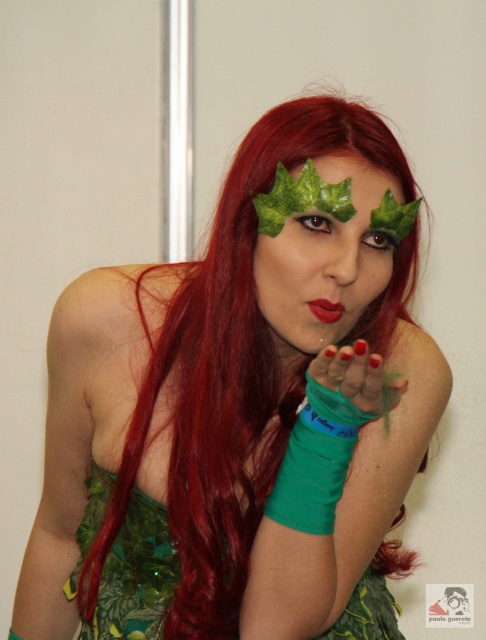
What are the coordinates of the green matte leaf at center in the image?

The green matte leaf at center is located at point (326, 259).

You are a photographer setting up for a photoshoot. The subject is wearing a green fabric dress at center. You want to ensure the dress is in focus while keeping the background slightly blurred. Given the distance between the dress and the camera, what is the minimum focal length you should use if the camera has an aperture of f1.4 and a sensor size of 36mm x 24mm?

To calculate the minimum focal length required, we can use the formula for depth of field. With the dress at 35.62 inches from the camera, an aperture of f1.4, and a sensor size of 36mm x 24mm, the minimum focal length needed to keep the dress in focus while blurring the background would be approximately 50mm. This ensures sufficient depth of field separation at that distance.